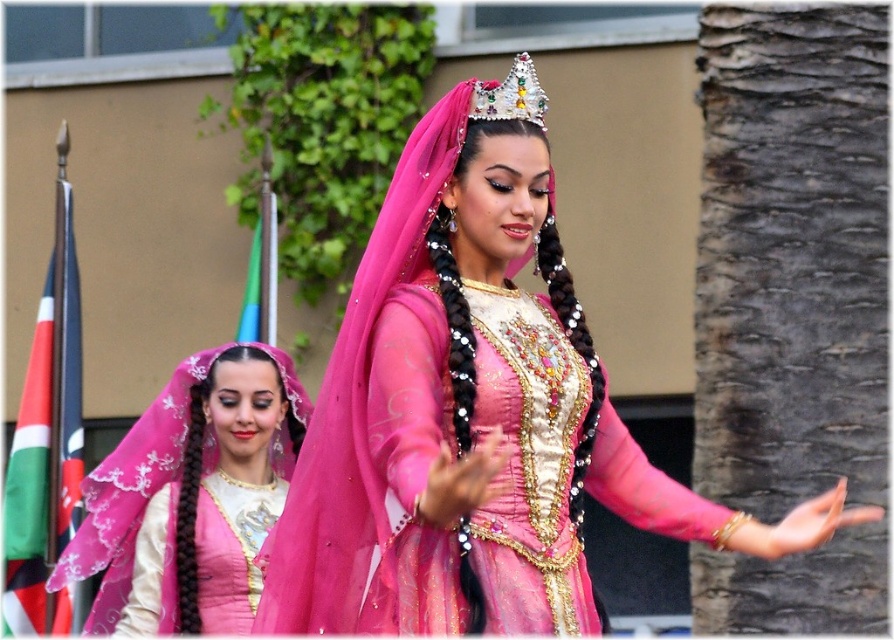
Question: Observing the image, what is the correct spatial positioning of matte pink fabric at center in reference to sparkling silver crown at center?

Choices:
 (A) left
 (B) right

Answer: (A)

Question: Which of these objects is positioned closest to the sparkling silver crown at center?

Choices:
 (A) matte pink dress at center
 (B) matte pink fabric at center

Answer: (A)

Question: Considering the relative positions of matte pink dress at center and matte pink fabric at center in the image provided, where is matte pink dress at center located with respect to matte pink fabric at center?

Choices:
 (A) above
 (B) below

Answer: (B)

Question: Based on their relative distances, which object is farther from the matte pink dress at center?

Choices:
 (A) matte pink fabric at center
 (B) sparkling silver crown at center

Answer: (A)

Question: Which point is closer to the camera?

Choices:
 (A) matte pink dress at center
 (B) sparkling silver crown at center

Answer: (A)

Question: In this image, where is matte pink dress at center located relative to sparkling silver crown at center?

Choices:
 (A) right
 (B) left

Answer: (B)